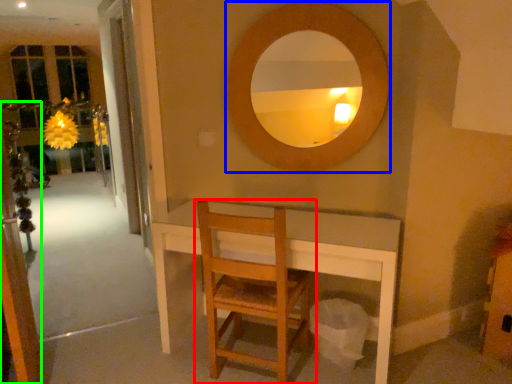
Question: Based on their relative distances, which object is nearer to chair (highlighted by a red box)? Choose from mirror (highlighted by a blue box) and screen door (highlighted by a green box).

Choices:
 (A) mirror
 (B) screen door

Answer: (A)